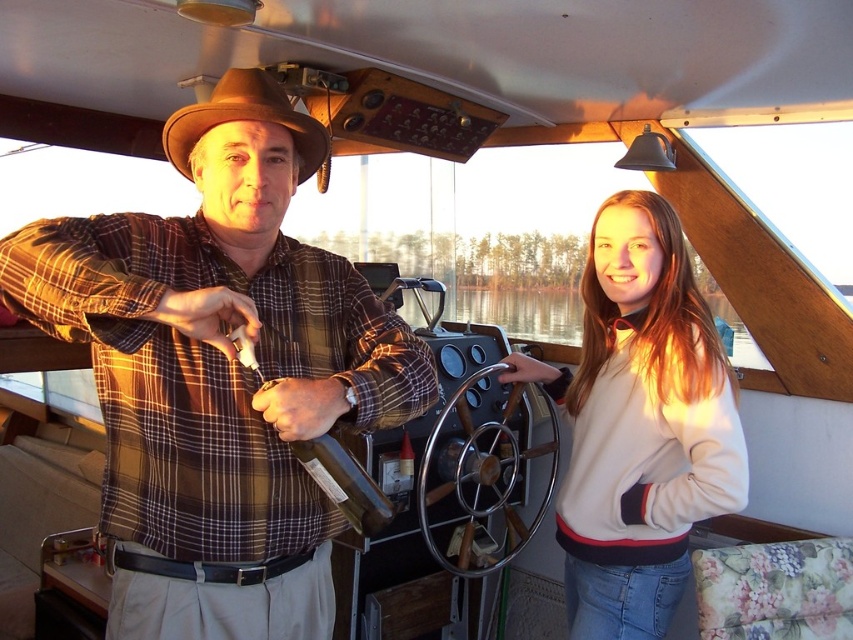
You are a photographer trying to capture a portrait of the man in the scene. Since both the brown plaid shirt at center and the light beige fleece at center are visible in the frame, which clothing item should you focus on to ensure the subject is clearly visible in the photo?

The brown plaid shirt at center is above the light beige fleece at center, so focusing on the brown plaid shirt at center will ensure the subject is clearly visible in the photo.

You are an interior designer assessing the boat interior. You notice the brown plaid shirt at center and the brown felt cowboy hat at upper center. Which object would require a larger storage compartment to accommodate it?

The brown plaid shirt at center requires a larger storage compartment because it has a larger size compared to the brown felt cowboy hat at upper center.

You are a photographer trying to capture a closeup of the light beige fleece at center and the brown felt cowboy hat at upper center. Since you want both items to appear the same size in the photo, which object should you move closer to the camera and which should you move farther away?

Since the light beige fleece at center is wider than the brown felt cowboy hat at upper center, you should move the brown felt cowboy hat at upper center closer to the camera and move the light beige fleece at center farther away to make them appear the same size in the photo.